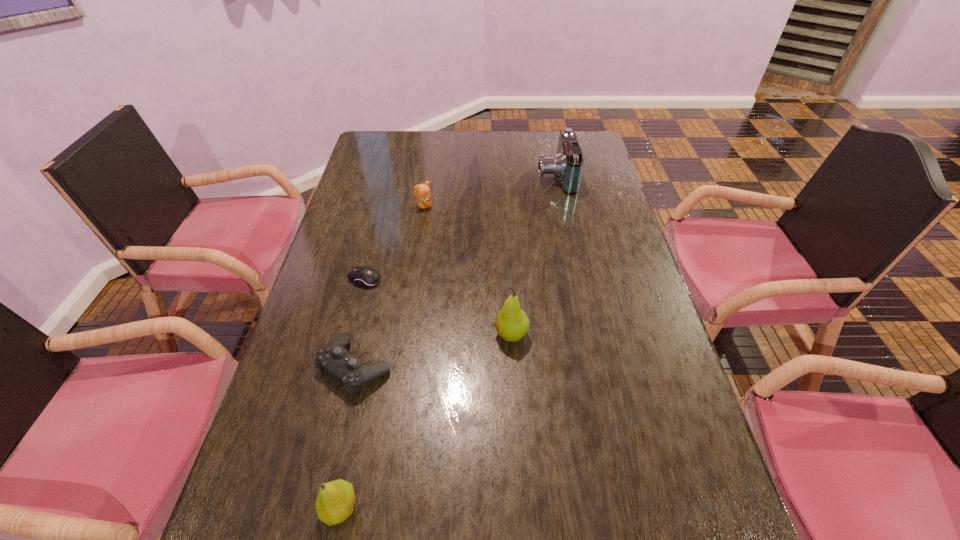
This screenshot has height=540, width=960. Find the location of `object at the near edge`. object at the near edge is located at coordinates (335, 502).

You are a GUI agent. You are given a task and a screenshot of the screen. Output one action in this format:
    pyautogui.click(x=<x>, y=<y>)
    Task: Click on the pear that is positioned at the left edge
    The image size is (960, 540).
    Given the screenshot: What is the action you would take?
    pyautogui.click(x=335, y=502)

This screenshot has width=960, height=540. Find the location of `computer mouse that is at the left edge`. computer mouse that is at the left edge is located at coordinates (364, 276).

Locate an element on the screen. The image size is (960, 540). control positioned at the left edge is located at coordinates (333, 358).

Where is `object at the right edge`? The width and height of the screenshot is (960, 540). object at the right edge is located at coordinates (567, 165).

In order to click on object that is at the near left corner in this screenshot , I will do `click(335, 502)`.

You are a GUI agent. You are given a task and a screenshot of the screen. Output one action in this format:
    pyautogui.click(x=<x>, y=<y>)
    Task: Click on the object that is at the far right corner
    The width and height of the screenshot is (960, 540).
    Given the screenshot: What is the action you would take?
    pyautogui.click(x=567, y=165)

The height and width of the screenshot is (540, 960). In the image, there is a desktop. Identify the location of free space at the far edge. (499, 153).

Locate an element on the screen. This screenshot has height=540, width=960. free space at the near edge of the desktop is located at coordinates (576, 502).

Find the location of `vacant space at the left edge`. vacant space at the left edge is located at coordinates (382, 188).